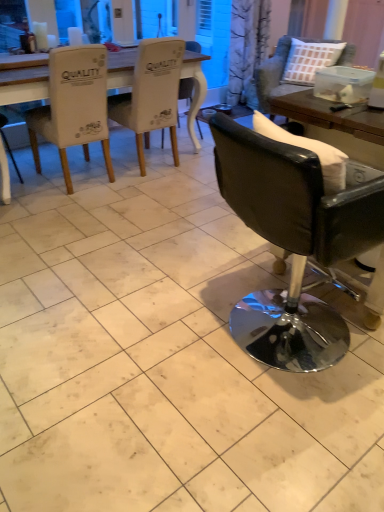
Identify the location of vacant space in white fabric chair at upper left, which ranks as the 1th chair in left-to-right order (from a real-world perspective). (86, 180).